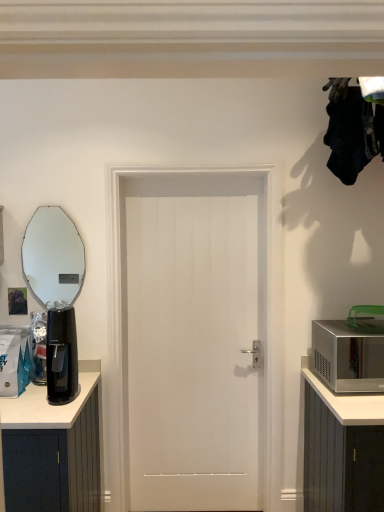
You are a GUI agent. You are given a task and a screenshot of the screen. Output one action in this format:
    pyautogui.click(x=<x>, y=<y>)
    Task: Click on the silver metallic microwave at right
    This screenshot has height=512, width=384.
    Given the screenshot: What is the action you would take?
    pyautogui.click(x=349, y=355)

What are the coordinates of `white smooth door at center` in the screenshot? It's located at (193, 340).

Which of these two, silver metallic microwave at right or white smooth door at center, is bigger?

white smooth door at center.

Which object is positioned more to the left, silver metallic microwave at right or white smooth door at center?

From the viewer's perspective, white smooth door at center appears more on the left side.

Which of these two, silver metallic microwave at right or white smooth door at center, stands shorter?

Standing shorter between the two is silver metallic microwave at right.

Is silver metallic microwave at right completely or partially outside of white smooth door at center?

That's correct, silver metallic microwave at right is outside of white smooth door at center.

Looking at this image, considering the relative sizes of oval mirror at left and silver metallic microwave at right in the image provided, is oval mirror at left taller than silver metallic microwave at right?

Yes.

Considering the relative positions of oval mirror at left and silver metallic microwave at right in the image provided, is oval mirror at left to the left or to the right of silver metallic microwave at right?

oval mirror at left is positioned on silver metallic microwave at right's left side.

Which is correct: oval mirror at left is inside silver metallic microwave at right, or outside of it?

oval mirror at left cannot be found inside silver metallic microwave at right.

In the scene shown: Is oval mirror at left oriented towards silver metallic microwave at right?

No, oval mirror at left does not turn towards silver metallic microwave at right.

From a real-world perspective, is white smooth door at center below oval mirror at left?

Correct, in the physical world, white smooth door at center is lower than oval mirror at left.

Identify the location of mirror above the white smooth door at center (from the image's perspective). (53, 257).

Is white smooth door at center completely or partially outside of oval mirror at left?

Yes, white smooth door at center is located beyond the bounds of oval mirror at left.

Considering the sizes of objects white smooth door at center and silver metallic microwave at right in the image provided, who is bigger, white smooth door at center or silver metallic microwave at right?

white smooth door at center.

Between white smooth door at center and silver metallic microwave at right, which one is positioned behind?

white smooth door at center is more distant.

Does white smooth door at center have a greater width compared to silver metallic microwave at right?

No, white smooth door at center is not wider than silver metallic microwave at right.

Between white smooth door at center and silver metallic microwave at right, which one has more height?

white smooth door at center.

How distant is silver metallic microwave at right from oval mirror at left?

A distance of 2.37 meters exists between silver metallic microwave at right and oval mirror at left.

From a real-world perspective, which object rests below the other?

silver metallic microwave at right is physically lower.

Is point (348, 326) positioned after point (57, 213)?

No, (348, 326) is closer to viewer.

How many degrees apart are the facing directions of silver metallic microwave at right and oval mirror at left?

silver metallic microwave at right and oval mirror at left are facing 0.082 degrees away from each other.

Does black plastic coffee maker at left have a greater width compared to white smooth door at center?

Correct, the width of black plastic coffee maker at left exceeds that of white smooth door at center.

Who is taller, black plastic coffee maker at left or white smooth door at center?

white smooth door at center is taller.

Can you confirm if black plastic coffee maker at left is positioned to the left of white smooth door at center?

Correct, you'll find black plastic coffee maker at left to the left of white smooth door at center.

Consider the image. Is black plastic coffee maker at left oriented towards white smooth door at center?

No, black plastic coffee maker at left is not facing towards white smooth door at center.

Is silver metallic microwave at right with black plastic coffee maker at left?

No, silver metallic microwave at right is not in contact with black plastic coffee maker at left.

Which is farther from the camera, (380, 362) or (64, 362)?

Point (380, 362)

Can you confirm if silver metallic microwave at right is shorter than black plastic coffee maker at left?

Yes, silver metallic microwave at right is shorter than black plastic coffee maker at left.

Where is `door above the silver metallic microwave at right (from the image's perspective)`? door above the silver metallic microwave at right (from the image's perspective) is located at coordinates (193, 340).

This screenshot has width=384, height=512. Identify the location of microwave oven below the oval mirror at left (from a real-world perspective). (349, 355).

When comparing their distances from oval mirror at left, does black plastic coffee maker at left or silver metallic microwave at right seem further?

silver metallic microwave at right is further to oval mirror at left.

Which object lies further to the anchor point white smooth door at center, oval mirror at left or black plastic coffee maker at left?

Based on the image, oval mirror at left appears to be further to white smooth door at center.

Estimate the real-world distances between objects in this image. Which object is closer to oval mirror at left, black plastic coffee maker at left or white smooth door at center?

Based on the image, black plastic coffee maker at left appears to be nearer to oval mirror at left.

Which object lies further to the anchor point black plastic coffee maker at left, white smooth door at center or oval mirror at left?

oval mirror at left is positioned further to the anchor black plastic coffee maker at left.

Looking at the image, which one is located closer to silver metallic microwave at right, oval mirror at left or white smooth door at center?

Based on the image, white smooth door at center appears to be nearer to silver metallic microwave at right.

Which object lies further to the anchor point silver metallic microwave at right, white smooth door at center or black plastic coffee maker at left?

black plastic coffee maker at left.

In the scene shown: Estimate the real-world distances between objects in this image. Which object is further from oval mirror at left, silver metallic microwave at right or black plastic coffee maker at left?

Among the two, silver metallic microwave at right is located further to oval mirror at left.

From the image, which object appears to be farther from black plastic coffee maker at left, silver metallic microwave at right or oval mirror at left?

oval mirror at left is further to black plastic coffee maker at left.

Find the location of a particular element. appliance between oval mirror at left and silver metallic microwave at right in the horizontal direction is located at coordinates (61, 356).

Locate an element on the screen. The width and height of the screenshot is (384, 512). door between black plastic coffee maker at left and silver metallic microwave at right is located at coordinates (193, 340).

The height and width of the screenshot is (512, 384). I want to click on appliance between oval mirror at left and white smooth door at center in the horizontal direction, so click(61, 356).

Locate an element on the screen. door located between oval mirror at left and silver metallic microwave at right in the left-right direction is located at coordinates (193, 340).